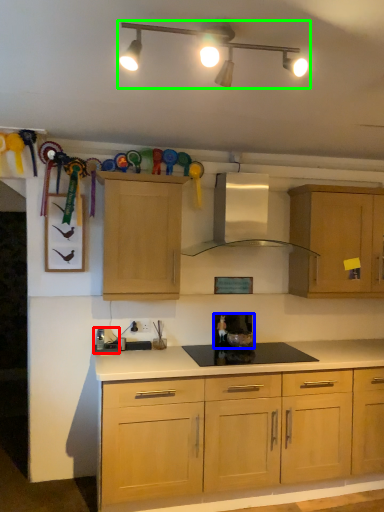
Question: Estimate the real-world distances between objects in this image. Which object is closer to appliance (highlighted by a red box), appliance (highlighted by a blue box) or light fixture (highlighted by a green box)?

Choices:
 (A) appliance
 (B) light fixture

Answer: (A)